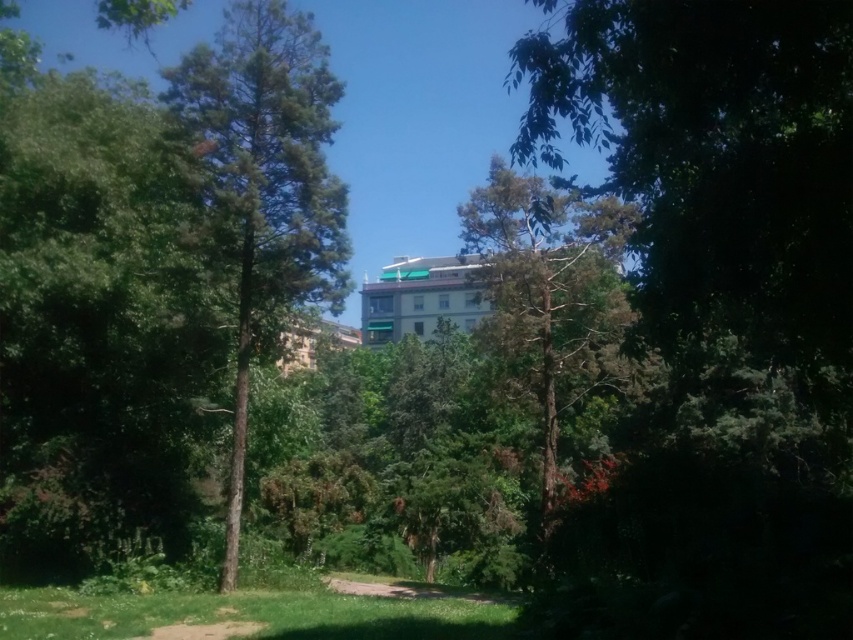
In the scene shown: You are standing at the entrance of the park and see both the green leafy tree at center and the green textured tree at center. Which tree is positioned to the left side from your viewpoint?

The green leafy tree at center is to the left of the green textured tree at center from your viewpoint.

You are a hiker trying to find the narrowest path between the green leafy tree at center and the green textured tree at center. Which tree should you approach to find the narrower path?

The green leafy tree at center is thinner than the green textured tree at center, so the path near the green leafy tree at center is narrower.

Based on the photo, you are standing on the dirt path in the park and see both the green leafy tree at center and the green textured tree at center. Which tree is closer to you?

The green leafy tree at center is closer to you because it is positioned further to the viewer than the green textured tree at center.